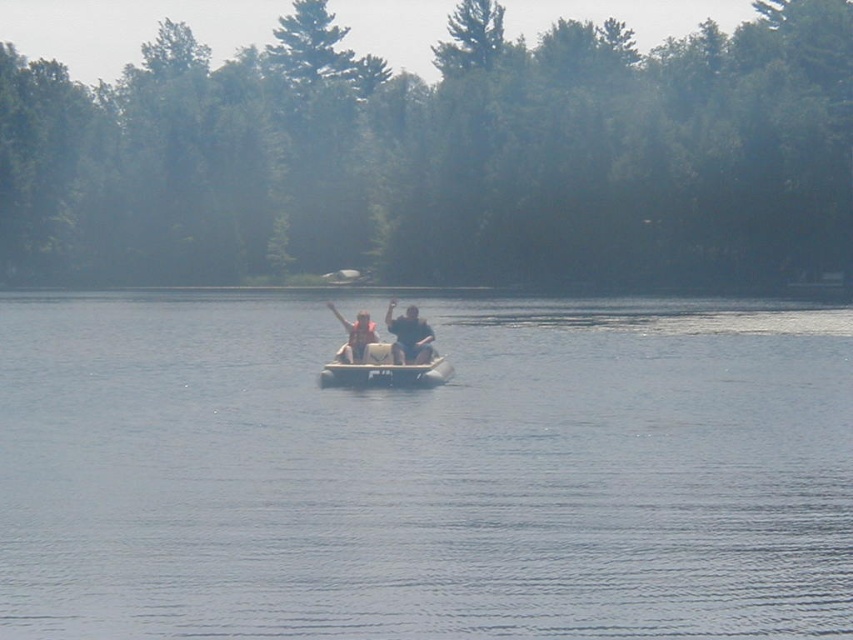
Question: Does matte white raft at center have a larger size compared to dark blue fabric life vest at center?

Choices:
 (A) no
 (B) yes

Answer: (B)

Question: Among these points, which one is nearest to the camera?

Choices:
 (A) (422, 346)
 (B) (425, 548)
 (C) (321, 378)
 (D) (339, 317)

Answer: (B)

Question: Which point is farther from the camera taking this photo?

Choices:
 (A) (421, 342)
 (B) (425, 342)

Answer: (B)

Question: Which point is farther from the camera taking this photo?

Choices:
 (A) (431, 380)
 (B) (355, 326)
 (C) (412, 340)
 (D) (184, 525)

Answer: (C)

Question: Does beige rubber boat at center come behind matte white raft at center?

Choices:
 (A) yes
 (B) no

Answer: (B)

Question: Is clear blue water at center positioned in front of matte white raft at center?

Choices:
 (A) no
 (B) yes

Answer: (B)